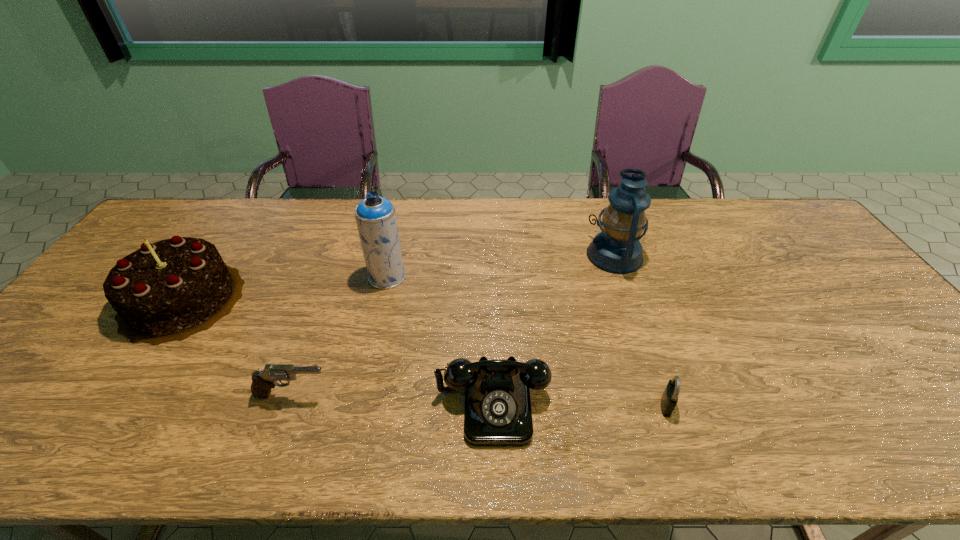
In order to click on lantern in this screenshot , I will do `click(617, 249)`.

Find the location of `the fourth object from right to left`. the fourth object from right to left is located at coordinates (375, 216).

The width and height of the screenshot is (960, 540). I want to click on the fourth shortest object, so click(x=166, y=291).

Where is `the leftmost object`? the leftmost object is located at coordinates (166, 291).

Image resolution: width=960 pixels, height=540 pixels. Identify the location of the third object from right to left. (498, 412).

This screenshot has width=960, height=540. I want to click on the second object from left to right, so click(263, 381).

Image resolution: width=960 pixels, height=540 pixels. Find the location of `the shortest object`. the shortest object is located at coordinates (669, 399).

Find the location of `free space located on the face of the lantern`. free space located on the face of the lantern is located at coordinates (548, 255).

I want to click on vacant region located on the face of the lantern, so click(465, 255).

I want to click on free space located on the face of the lantern, so click(506, 255).